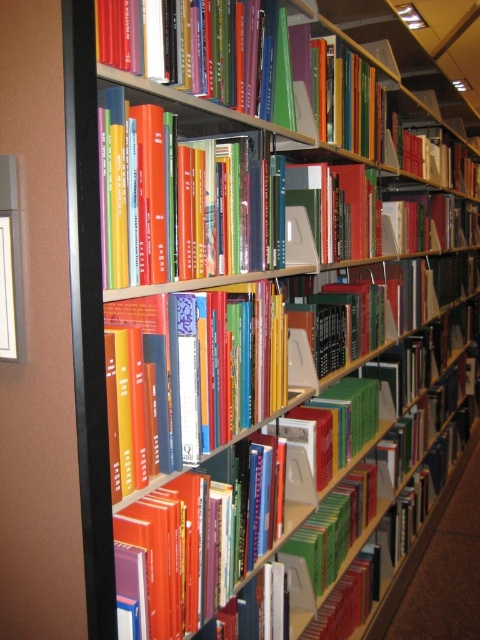
Is hardcover books at center positioned at the back of hardcover book at center?

No.

Which of these two, hardcover books at center or hardcover book at center, stands shorter?

hardcover book at center

Between point (116, 170) and point (255, 381), which one is positioned in front?

Point (116, 170) is more forward.

Identify the location of hardcover books at center. (183, 198).